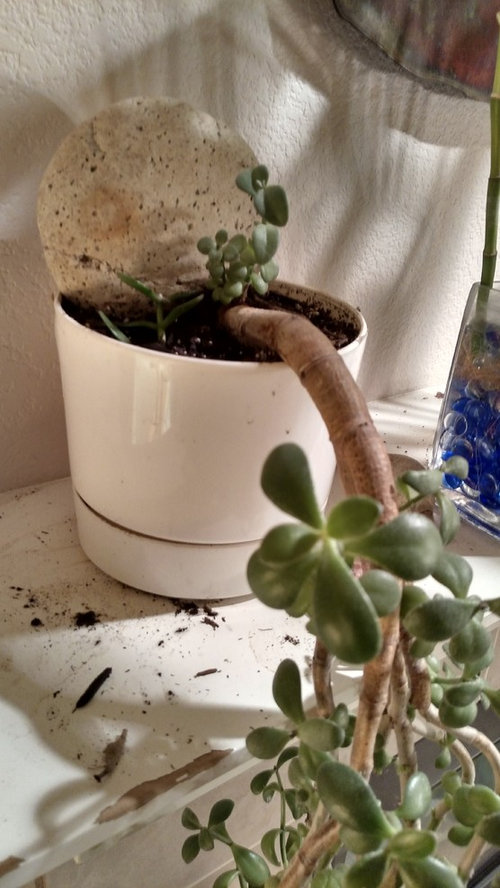
Find the location of a particular element. red on wall is located at coordinates (430, 44).